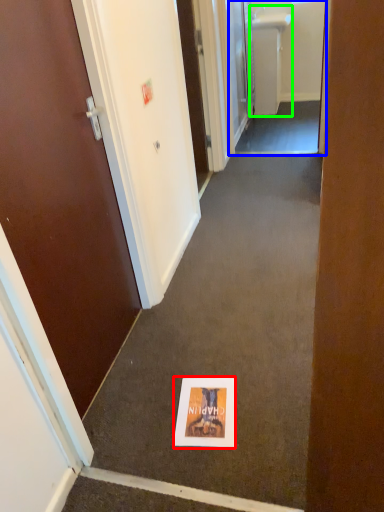
Question: Which object is the farthest from flyer (highlighted by a red box)? Choose among these: passage (highlighted by a blue box) or sink (highlighted by a green box).

Choices:
 (A) passage
 (B) sink

Answer: (B)